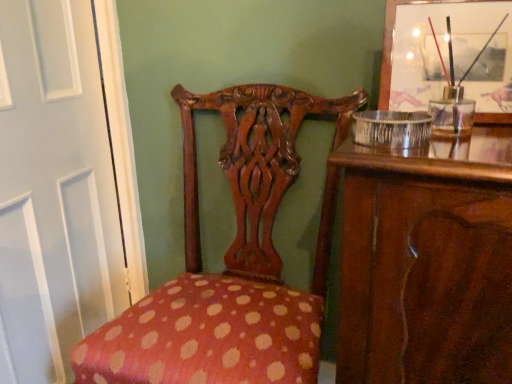
Question: Is white glossy door at left positioned with its back to wooden picture frame at upper right?

Choices:
 (A) no
 (B) yes

Answer: (B)

Question: Is white glossy door at left in front of wooden picture frame at upper right?

Choices:
 (A) yes
 (B) no

Answer: (B)

Question: Is white glossy door at left next to wooden picture frame at upper right?

Choices:
 (A) no
 (B) yes

Answer: (A)

Question: From a real-world perspective, does white glossy door at left stand above wooden picture frame at upper right?

Choices:
 (A) yes
 (B) no

Answer: (B)

Question: Could you tell me if white glossy door at left is turned towards wooden picture frame at upper right?

Choices:
 (A) yes
 (B) no

Answer: (B)

Question: Considering their positions, is wooden picture frame at upper right located in front of or behind white glossy door at left?

Choices:
 (A) behind
 (B) front

Answer: (B)

Question: From a real-world perspective, is wooden picture frame at upper right positioned above or below white glossy door at left?

Choices:
 (A) above
 (B) below

Answer: (A)

Question: Is wooden picture frame at upper right spatially inside white glossy door at left, or outside of it?

Choices:
 (A) inside
 (B) outside

Answer: (B)

Question: In terms of height, does wooden picture frame at upper right look taller or shorter compared to white glossy door at left?

Choices:
 (A) short
 (B) tall

Answer: (A)

Question: From a real-world perspective, is white glossy door at left physically located above or below polka dot fabric chair at center?

Choices:
 (A) below
 (B) above

Answer: (B)

Question: Is white glossy door at left inside the boundaries of polka dot fabric chair at center, or outside?

Choices:
 (A) outside
 (B) inside

Answer: (A)

Question: In the image, is white glossy door at left positioned in front of or behind polka dot fabric chair at center?

Choices:
 (A) behind
 (B) front

Answer: (A)

Question: Looking at the image, does white glossy door at left seem bigger or smaller compared to polka dot fabric chair at center?

Choices:
 (A) small
 (B) big

Answer: (A)

Question: Would you say polka dot fabric chair at center is to the left or to the right of white glossy door at left in the picture?

Choices:
 (A) left
 (B) right

Answer: (B)

Question: Based on their sizes in the image, would you say polka dot fabric chair at center is bigger or smaller than white glossy door at left?

Choices:
 (A) big
 (B) small

Answer: (A)